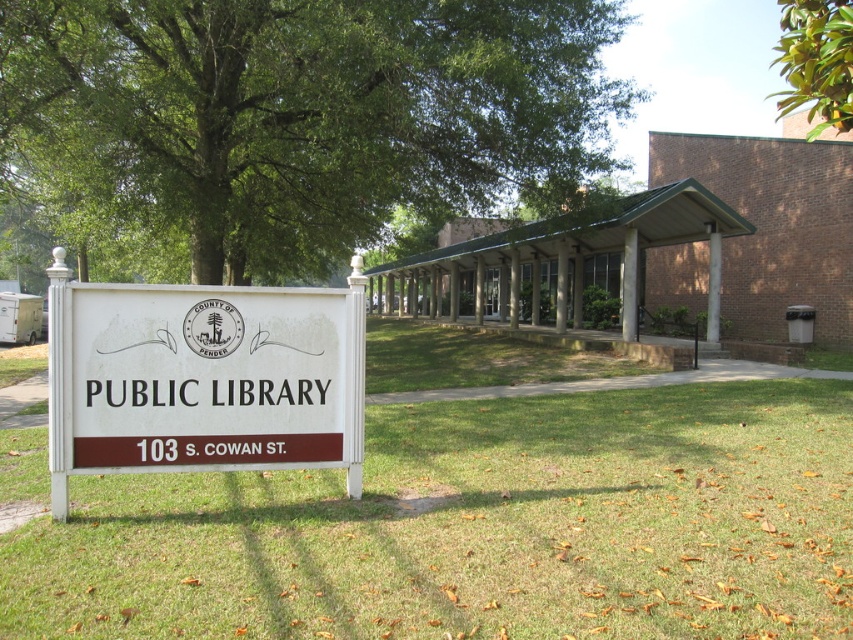
You are standing at the entrance of the library and want to read the white plastic sign at center. However, there is a green leafy tree at upper right in the background. Can you see the entire sign clearly without any obstruction?

The white plastic sign at center is in front of the green leafy tree at upper right, so the sign blocks the view of the tree but you can still see the entire sign clearly without obstruction.

In the scene shown: You are standing in front of the library and looking at its sign. There are two points marked on the sign. One is at coordinate point (503, 132) and the other is at point (822, 19). Which point is closer to you?

Point (503, 132) is further to the camera than point (822, 19), so the point closer to you is point (822, 19).